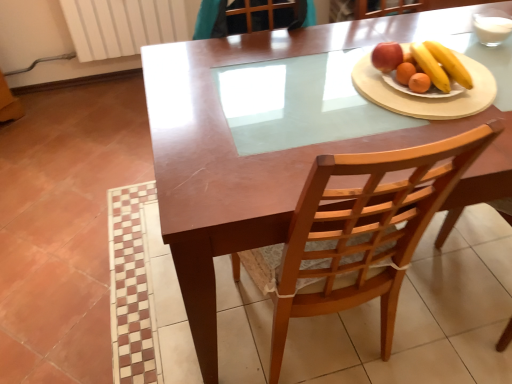
I want to click on vacant space positioned to the left of wooden chair at center, so click(x=172, y=319).